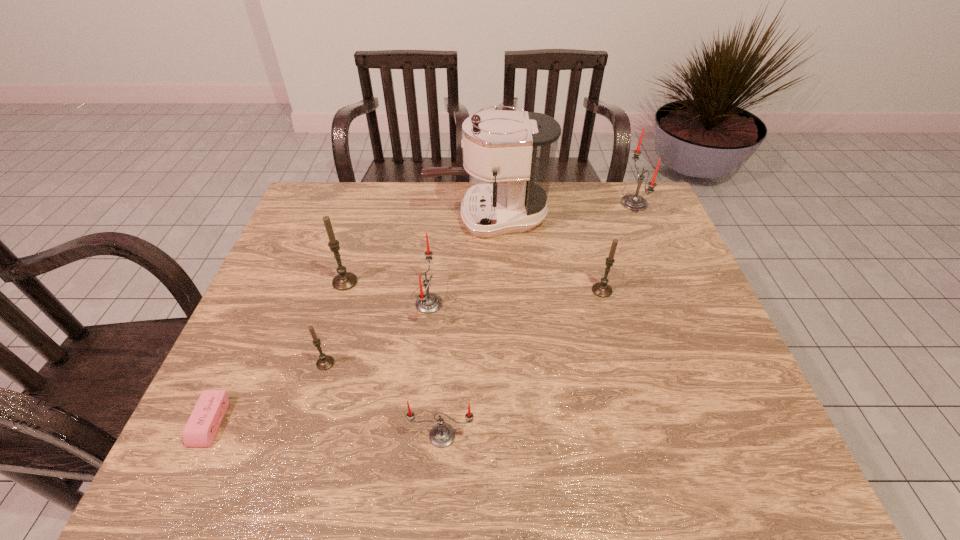
Where is `the smallest red candle`? This screenshot has width=960, height=540. the smallest red candle is located at coordinates 442,435.

Where is `the nearest red candle`? the nearest red candle is located at coordinates (442, 435).

I want to click on eraser, so click(x=201, y=428).

Identify the location of the shortest object. (201, 428).

Find the location of a particular element. Image resolution: width=960 pixels, height=540 pixels. free space located on the front-facing side of the white coffee maker is located at coordinates (326, 218).

Identify the location of free space located 0.160m on the front-facing side of the white coffee maker. (x=376, y=218).

Identify the location of blank area located 0.090m on the front-facing side of the white coffee maker. The height and width of the screenshot is (540, 960). (398, 218).

At what (x,y) coordinates should I click in order to perform the action: click on free space located 0.070m on the front-facing side of the biggest red candle. Please return your answer as a coordinate pair (x, y). The image size is (960, 540). Looking at the image, I should click on (600, 203).

Find the location of `blank space located on the front-facing side of the biggest red candle`. blank space located on the front-facing side of the biggest red candle is located at coordinates (597, 203).

The image size is (960, 540). Identify the location of free space located 0.050m on the front-facing side of the biggest red candle. (606, 203).